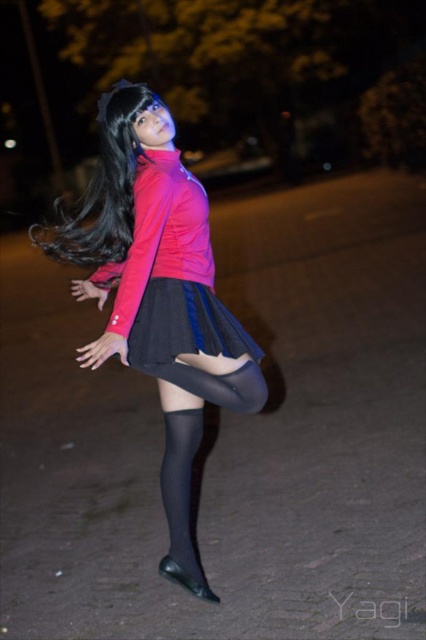
Question: Is matte pink jacket at center positioned behind black silky hair at center?

Choices:
 (A) yes
 (B) no

Answer: (B)

Question: Among these points, which one is nearest to the camera?

Choices:
 (A) (183, 358)
 (B) (212, 596)
 (C) (137, 157)

Answer: (A)

Question: Considering the real-world distances, which object is closest to the black silky hair at center?

Choices:
 (A) black leather boot at lower center
 (B) matte pink jacket at center

Answer: (B)

Question: Does matte pink jacket at center lie behind black silky hair at center?

Choices:
 (A) yes
 (B) no

Answer: (B)

Question: Which is farther from the black silky hair at center?

Choices:
 (A) matte pink jacket at center
 (B) black leather boot at lower center

Answer: (B)

Question: Is matte pink jacket at center further to the viewer compared to black silky hair at center?

Choices:
 (A) yes
 (B) no

Answer: (B)